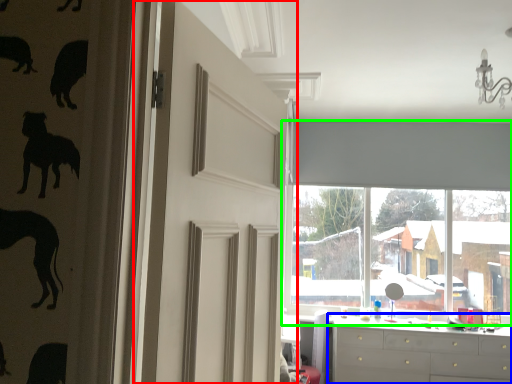
Question: Which is nearer to the door (highlighted by a red box)? chest of drawers (highlighted by a blue box) or window (highlighted by a green box).

Choices:
 (A) chest of drawers
 (B) window

Answer: (A)